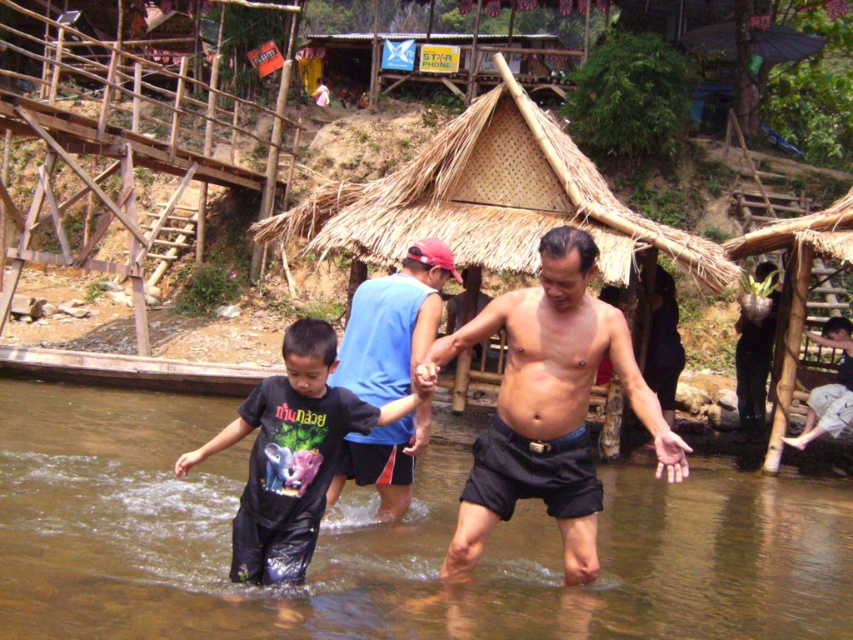
You are a photographer trying to capture the blue sleeveless shirt at center in the frame. The camera you are using has a focal length of 50mm and an aperture of f2.8. The shirt is located at coordinates point 0.506, 0.462. Can you confirm if the shirt is within the camera frame?

The blue sleeveless shirt at center is positioned at point (393, 323), which falls within the camera frame given the focal length and aperture settings.